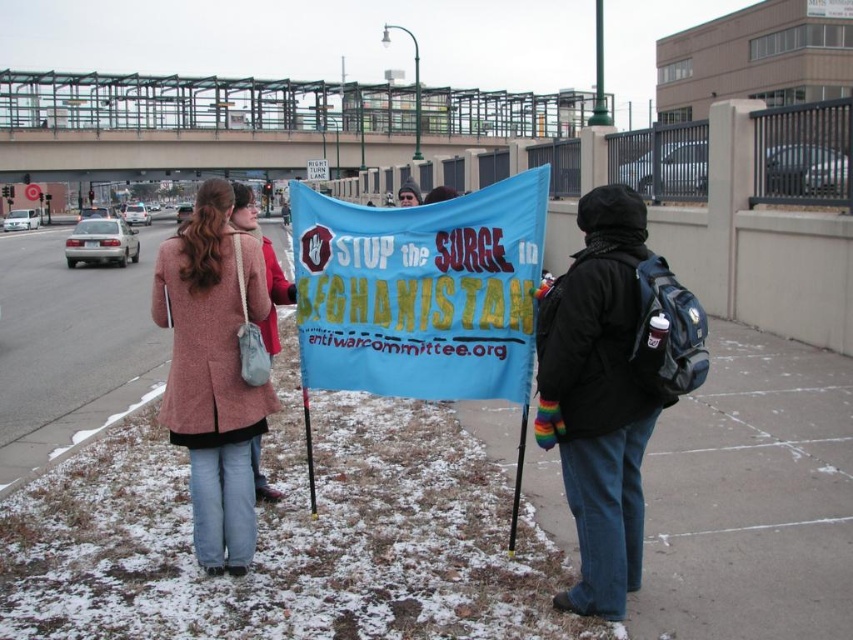
Is snow-covered concrete at center behind blue fabric banner at center?

No, it is in front of blue fabric banner at center.

Between snow-covered concrete at center and blue fabric banner at center, which one has less height?

blue fabric banner at center

I want to click on snow-covered concrete at center, so click(x=305, y=532).

Which is in front, point (375, 445) or point (589, 554)?

Point (589, 554)

Based on the photo, does snow-covered concrete at center have a greater height compared to black fleece jacket at center?

Yes, snow-covered concrete at center is taller than black fleece jacket at center.

Is point (834, 445) closer to camera compared to point (590, 506)?

No, (834, 445) is behind (590, 506).

Locate an element on the screen. This screenshot has width=853, height=640. snow-covered concrete at center is located at coordinates (305, 532).

Can you confirm if snow-covered concrete at center is positioned to the left of rustic wool coat at center?

Yes, snow-covered concrete at center is to the left of rustic wool coat at center.

Is snow-covered concrete at center positioned before rustic wool coat at center?

Yes, snow-covered concrete at center is closer to the viewer.

Between point (195, 573) and point (201, 380), which one is positioned in front?

Point (201, 380) is more forward.

Image resolution: width=853 pixels, height=640 pixels. I want to click on snow-covered concrete at center, so click(x=305, y=532).